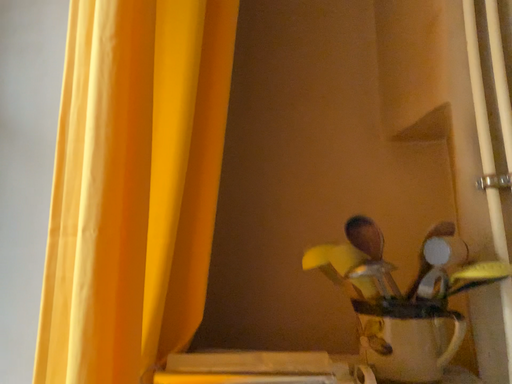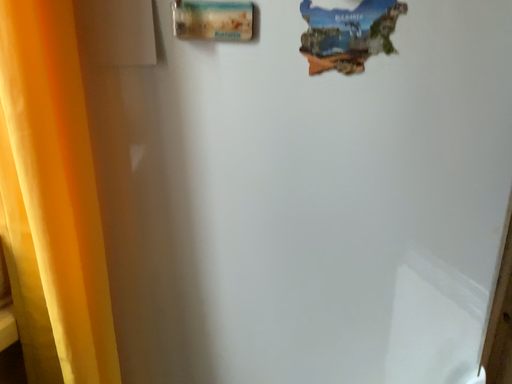
Question: Which way did the camera rotate in the video?

Choices:
 (A) rotated upward
 (B) rotated downward

Answer: (B)